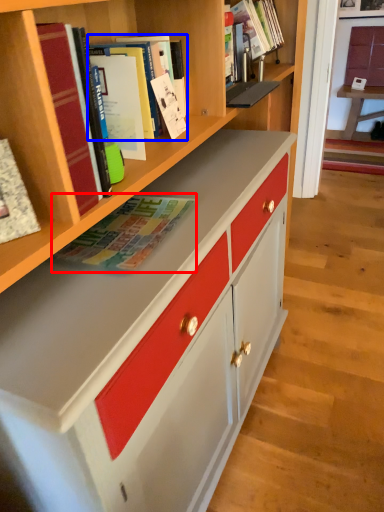
Question: Which object is closer to the camera taking this photo, book (highlighted by a red box) or book (highlighted by a blue box)?

Choices:
 (A) book
 (B) book

Answer: (A)